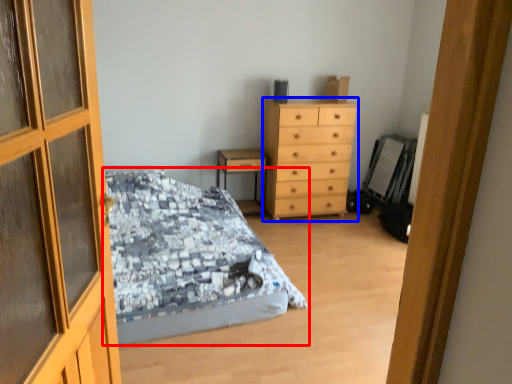
Question: Which object appears farthest to the camera in this image, bed (highlighted by a red box) or chest of drawers (highlighted by a blue box)?

Choices:
 (A) bed
 (B) chest of drawers

Answer: (B)